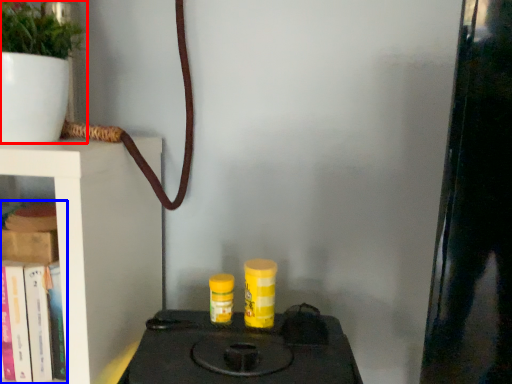
Question: Which object is closer to the camera taking this photo, houseplant (highlighted by a red box) or book (highlighted by a blue box)?

Choices:
 (A) houseplant
 (B) book

Answer: (A)